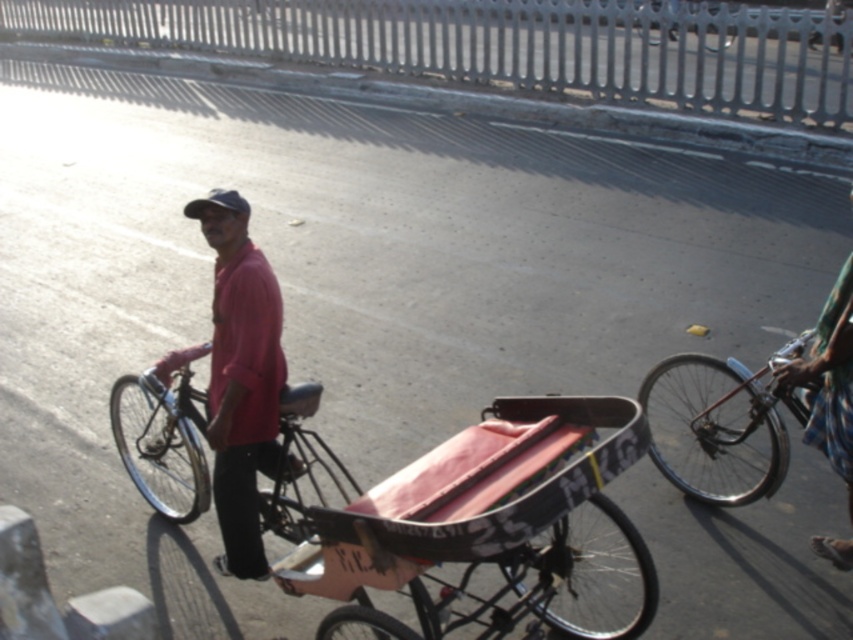
Question: Which object is positioned farthest from the shiny black bicycle at center?

Choices:
 (A) metallic silver bicycle at center
 (B) green plaid shirt at right
 (C) shiny metallic bicycle at right
 (D) pink matte shirt at center

Answer: (A)

Question: Does shiny metallic bicycle at right appear on the right side of green plaid shirt at right?

Choices:
 (A) yes
 (B) no

Answer: (B)

Question: Based on their relative distances, which object is nearer to the green plaid shirt at right?

Choices:
 (A) metallic silver bicycle at center
 (B) shiny black bicycle at center
 (C) pink matte shirt at center
 (D) shiny metallic bicycle at right

Answer: (D)

Question: Does shiny metallic bicycle at right have a smaller size compared to shiny black bicycle at center?

Choices:
 (A) no
 (B) yes

Answer: (A)

Question: Estimate the real-world distances between objects in this image. Which object is farther from the green plaid shirt at right?

Choices:
 (A) shiny black bicycle at center
 (B) pink matte shirt at center

Answer: (A)

Question: In this image, where is green plaid shirt at right located relative to metallic silver bicycle at center?

Choices:
 (A) below
 (B) above

Answer: (A)